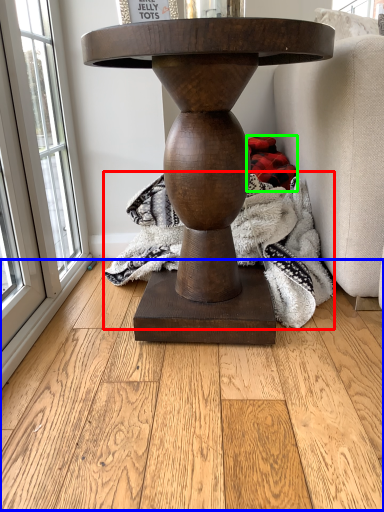
Question: Estimate the real-world distances between objects in this image. Which object is closer to blanket (highlighted by a red box), hardwood (highlighted by a blue box) or material (highlighted by a green box)?

Choices:
 (A) hardwood
 (B) material

Answer: (B)